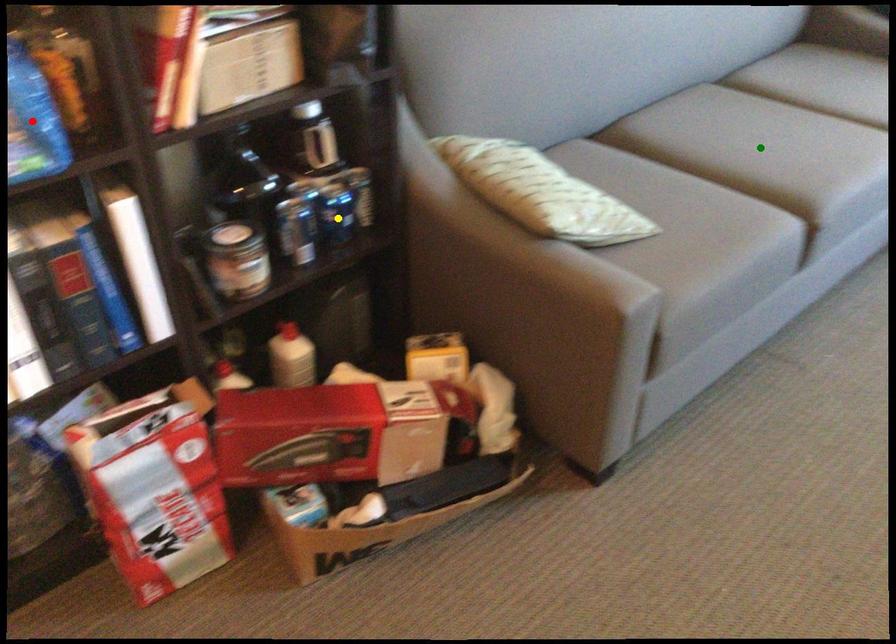
Order these from farthest to nearest:
green point, yellow point, red point

green point < yellow point < red point